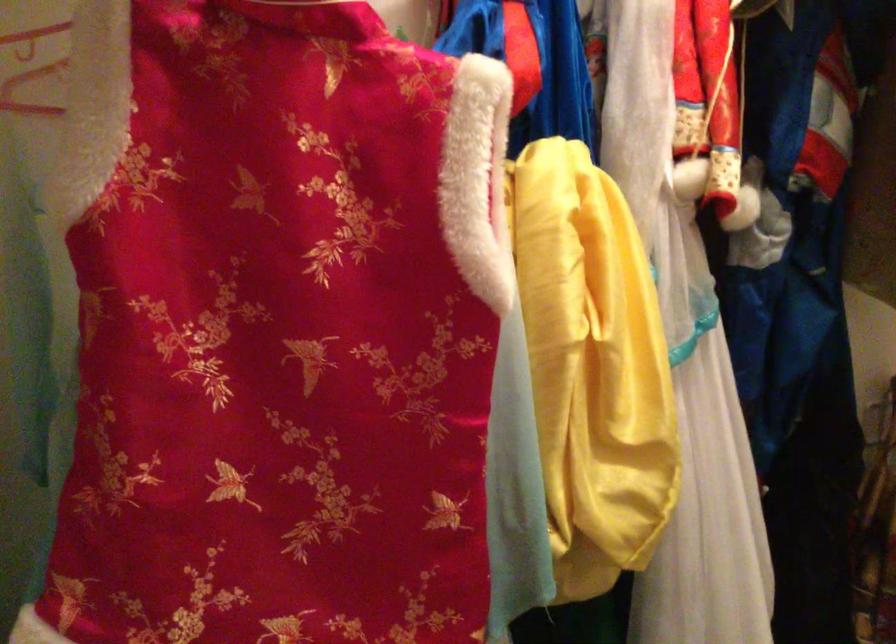
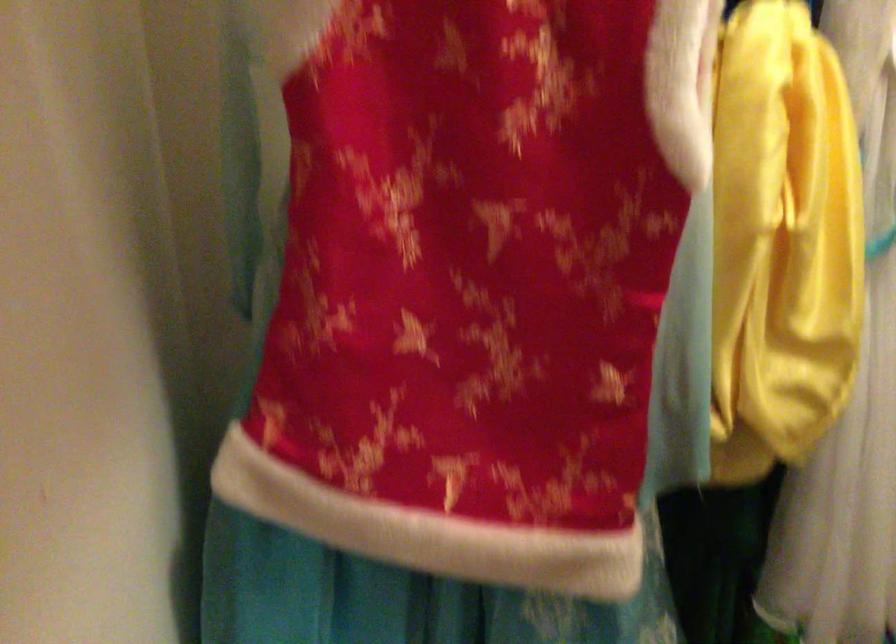
Which direction would the cameraman need to move to produce the second image?

The cameraman walked toward left, backward.